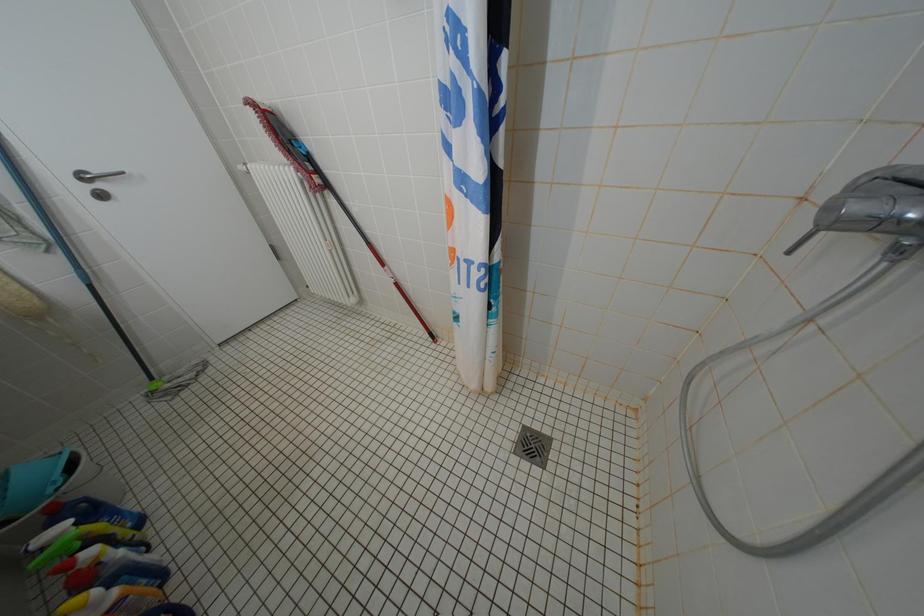
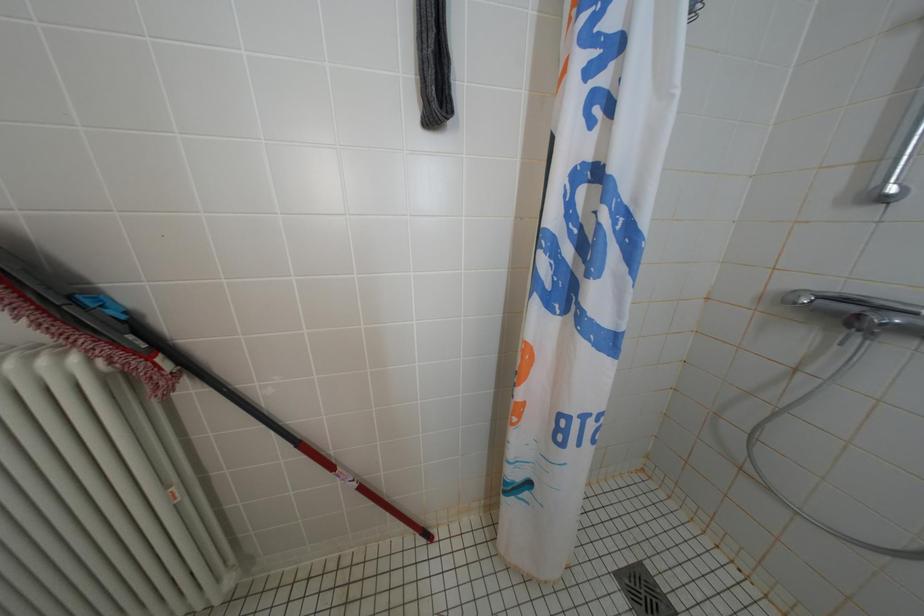
Question: The camera is either moving clockwise (left) or counter-clockwise (right) around the object. The first image is from the beginning of the video and the second image is from the end. Is the camera moving left or right when shooting the video?

Choices:
 (A) Left
 (B) Right

Answer: (A)